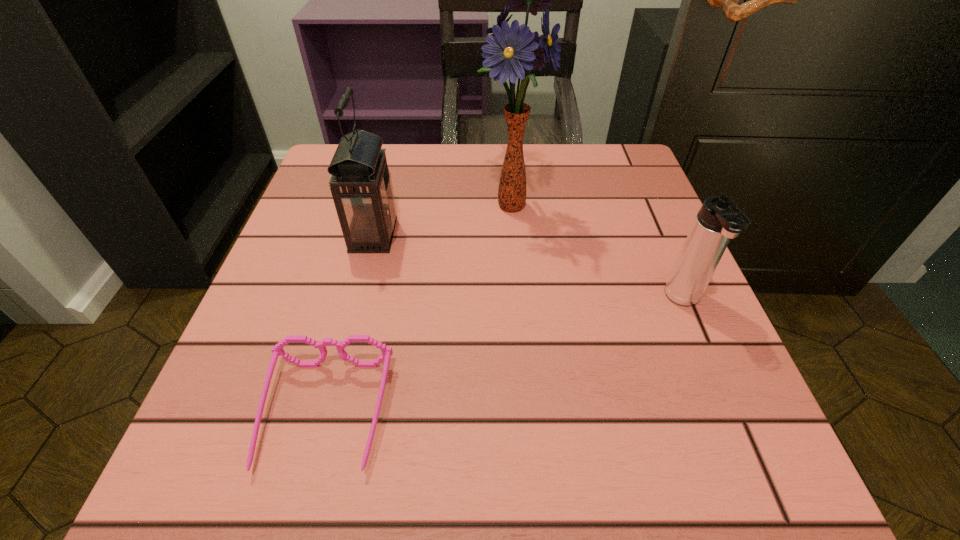
Locate an element on the screen. flower arrangement is located at coordinates (512, 50).

Where is `the tallest object`? Image resolution: width=960 pixels, height=540 pixels. the tallest object is located at coordinates (512, 50).

This screenshot has width=960, height=540. Find the location of `lantern`. lantern is located at coordinates 361,186.

The width and height of the screenshot is (960, 540). In order to click on the second shortest object in this screenshot , I will do `click(720, 218)`.

This screenshot has height=540, width=960. Identify the location of the rightmost object. (720, 218).

Where is `spectacles`? The height and width of the screenshot is (540, 960). spectacles is located at coordinates (278, 350).

The image size is (960, 540). Find the location of `the shortest object`. the shortest object is located at coordinates (278, 350).

Where is `vacant space located 0.070m on the front of the flower arrangement`? vacant space located 0.070m on the front of the flower arrangement is located at coordinates (514, 255).

The height and width of the screenshot is (540, 960). Identify the location of free space located 0.160m on the front-facing side of the lantern. (480, 235).

You are a GUI agent. You are given a task and a screenshot of the screen. Output one action in this format:
    pyautogui.click(x=<x>, y=<y>)
    Task: Click on the vacant point located 0.260m on the handle side of the rightmost object
    
    Given the screenshot: What is the action you would take?
    pyautogui.click(x=765, y=492)